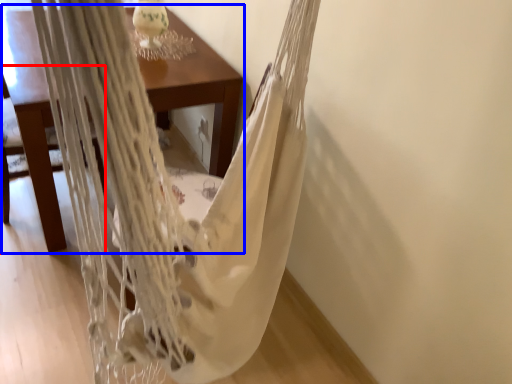
Question: Which object is further to the camera taking this photo, armchair (highlighted by a red box) or table (highlighted by a blue box)?

Choices:
 (A) armchair
 (B) table

Answer: (B)